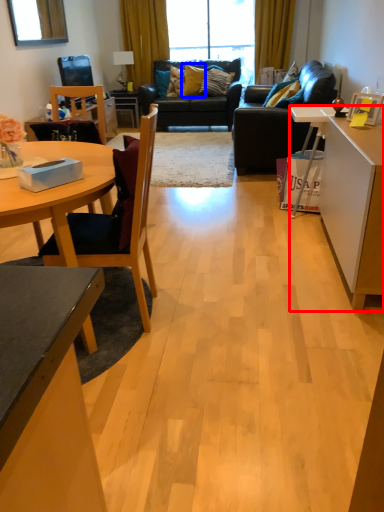
Question: Which object is closer to the camera taking this photo, table (highlighted by a red box) or pillow (highlighted by a blue box)?

Choices:
 (A) table
 (B) pillow

Answer: (A)